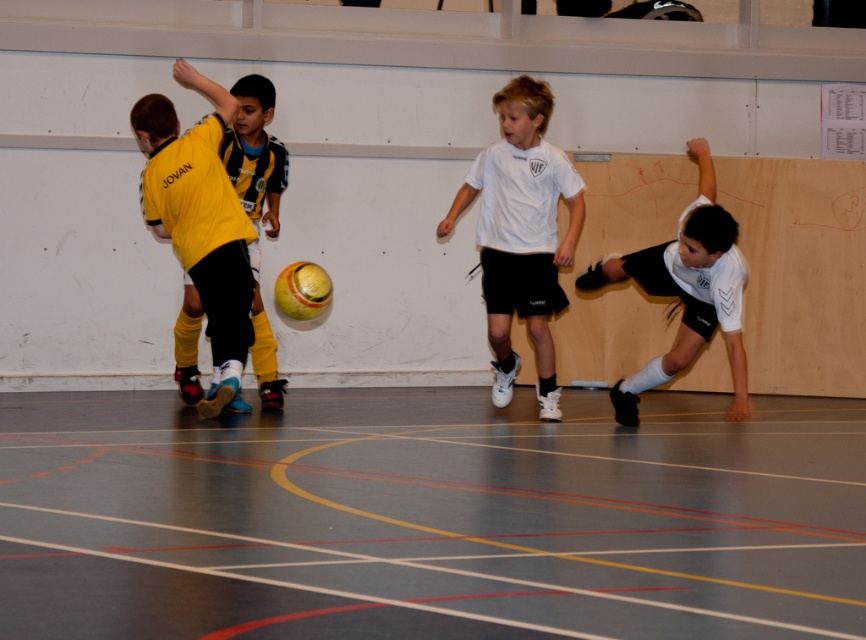
Question: Which of the following is the farthest from the observer?

Choices:
 (A) white matte shorts at right
 (B) yellow matte jersey at left

Answer: (B)

Question: Does smooth gray floor at center appear over white matte shorts at right?

Choices:
 (A) no
 (B) yes

Answer: (A)

Question: Does smooth gray floor at center appear on the right side of white matte shirt at center?

Choices:
 (A) yes
 (B) no

Answer: (B)

Question: Which object appears closest to the camera in this image?

Choices:
 (A) white matte shirt at center
 (B) white matte shorts at right
 (C) smooth gray floor at center
 (D) yellow matte jersey at left

Answer: (C)

Question: In this image, where is white matte shirt at center located relative to yellow matte jersey at left?

Choices:
 (A) left
 (B) right

Answer: (B)

Question: Which point is closer to the camera?

Choices:
 (A) white matte shorts at right
 (B) white matte shirt at center

Answer: (A)